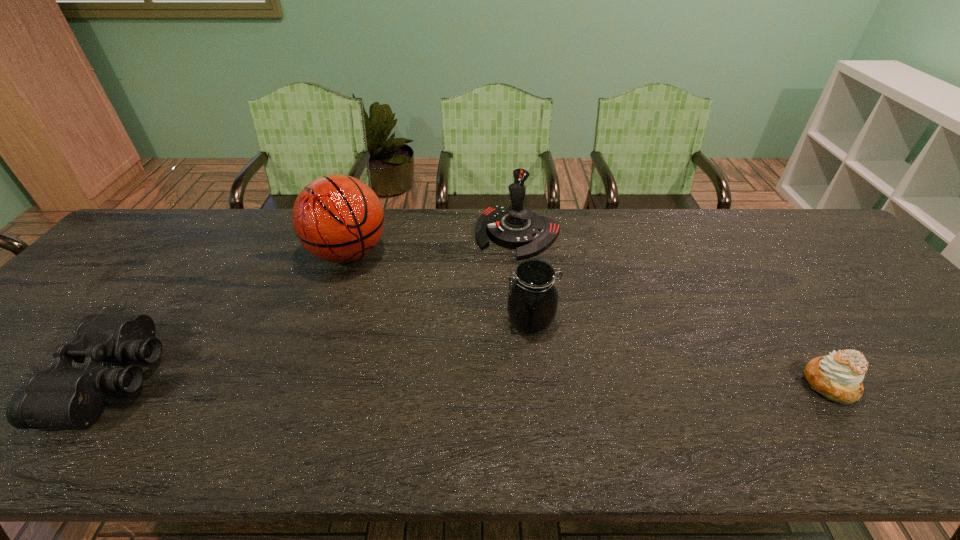
The width and height of the screenshot is (960, 540). Find the location of `vacant space on the desktop that is between the leftmost object and the rightmost object and is positioned on the lid of the jar`. vacant space on the desktop that is between the leftmost object and the rightmost object and is positioned on the lid of the jar is located at coordinates (423, 381).

This screenshot has height=540, width=960. In order to click on vacant space on the desktop that is between the binoculars and the pastry and is positioned on the side with spill of the fourth object from right to left in this screenshot , I will do `click(429, 381)`.

Where is `vacant spot on the desktop that is between the binoculars and the rightmost object and is positioned on the handle side of the fourth shortest object`? vacant spot on the desktop that is between the binoculars and the rightmost object and is positioned on the handle side of the fourth shortest object is located at coordinates tap(419, 381).